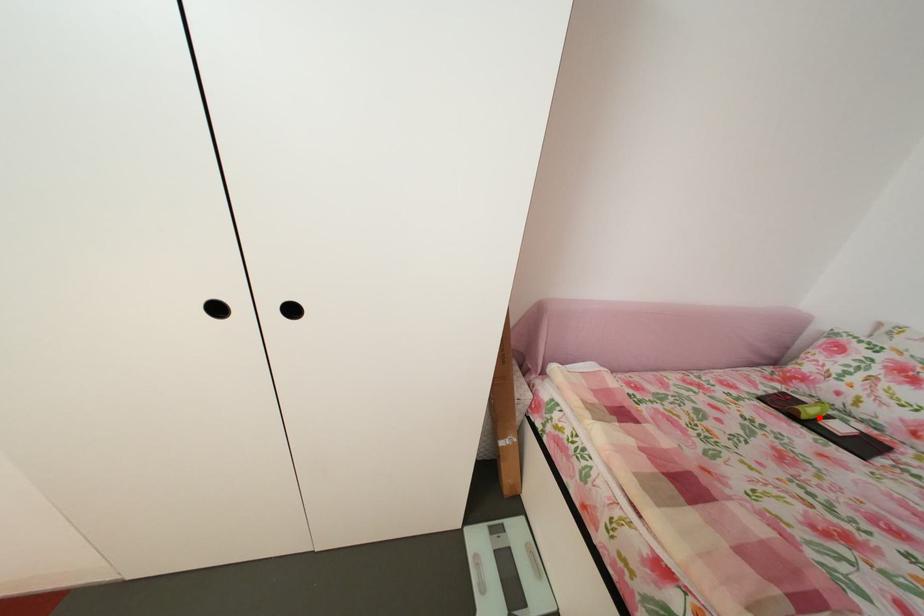
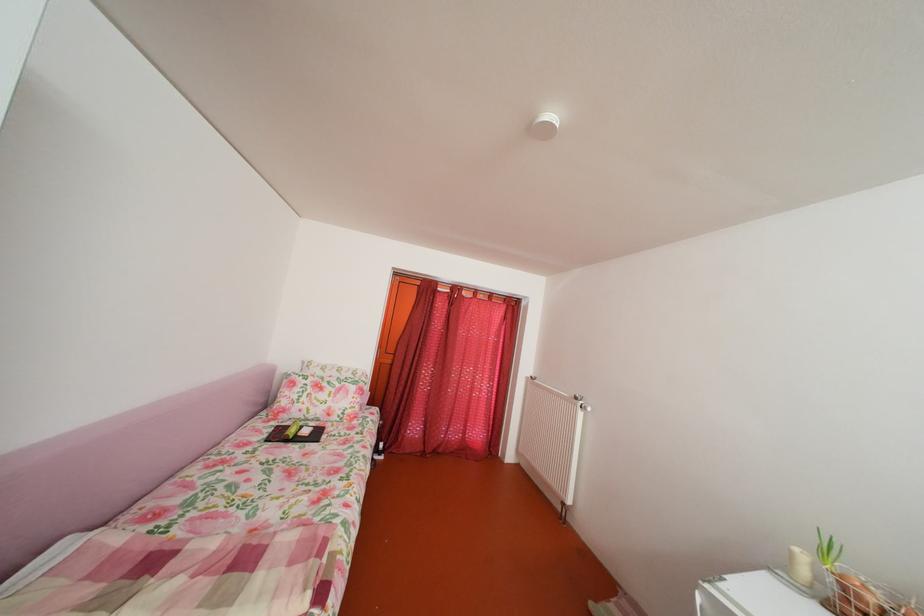
Question: A red point is marked in image1. In image2, is the corresponding 3D point closer to the camera or farther? Reply with the corresponding letter.

Choices:
 (A) The corresponding 3D point is closer.
 (B) The corresponding 3D point is farther.

Answer: (B)